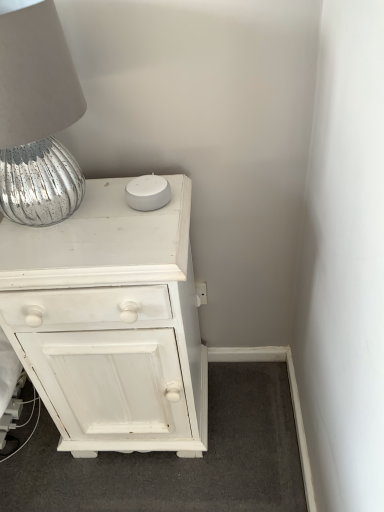
Question: Can we say silver textured lampshade at upper left lies outside white painted wood chest of drawers at upper left?

Choices:
 (A) yes
 (B) no

Answer: (A)

Question: Is silver textured lampshade at upper left at the right side of white painted wood chest of drawers at upper left?

Choices:
 (A) yes
 (B) no

Answer: (B)

Question: From a real-world perspective, is silver textured lampshade at upper left under white painted wood chest of drawers at upper left?

Choices:
 (A) no
 (B) yes

Answer: (A)

Question: Can you confirm if silver textured lampshade at upper left is smaller than white painted wood chest of drawers at upper left?

Choices:
 (A) no
 (B) yes

Answer: (B)

Question: Does silver textured lampshade at upper left have a lesser height compared to white painted wood chest of drawers at upper left?

Choices:
 (A) yes
 (B) no

Answer: (A)

Question: Are silver textured lampshade at upper left and white painted wood chest of drawers at upper left making contact?

Choices:
 (A) yes
 (B) no

Answer: (B)

Question: Is white painted wood chest of drawers at upper left at the right side of silver textured lampshade at upper left?

Choices:
 (A) no
 (B) yes

Answer: (B)

Question: Does white painted wood chest of drawers at upper left come in front of silver textured lampshade at upper left?

Choices:
 (A) yes
 (B) no

Answer: (B)

Question: Can you confirm if white painted wood chest of drawers at upper left is taller than silver textured lampshade at upper left?

Choices:
 (A) yes
 (B) no

Answer: (A)

Question: From the image's perspective, is white painted wood chest of drawers at upper left beneath silver textured lampshade at upper left?

Choices:
 (A) no
 (B) yes

Answer: (B)

Question: From a real-world perspective, does white painted wood chest of drawers at upper left stand above silver textured lampshade at upper left?

Choices:
 (A) yes
 (B) no

Answer: (B)

Question: Is white painted wood chest of drawers at upper left facing towards silver textured lampshade at upper left?

Choices:
 (A) yes
 (B) no

Answer: (B)

Question: From a real-world perspective, is white painted wood chest of drawers at upper left positioned above or below silver textured lampshade at upper left?

Choices:
 (A) below
 (B) above

Answer: (A)